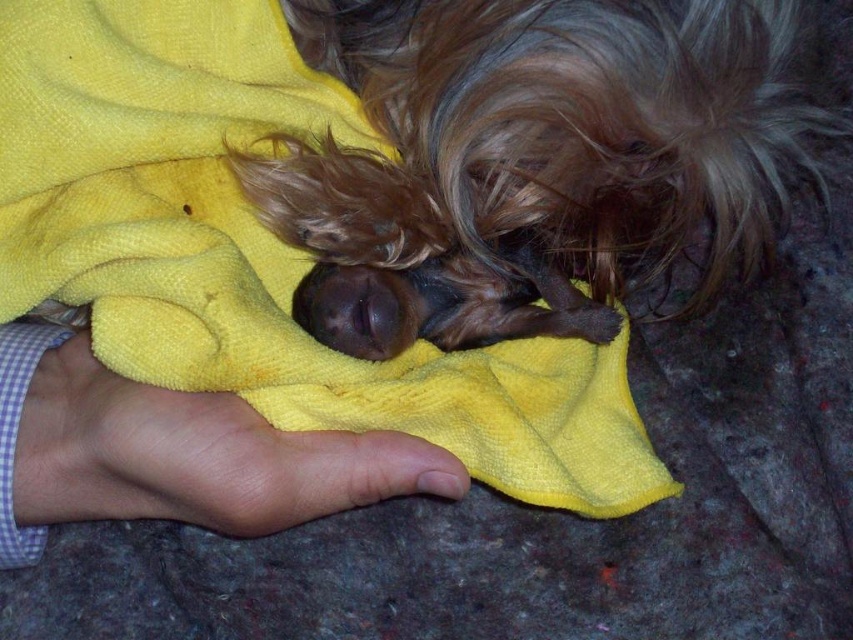
Question: Is shaggy brown fur at center to the right of yellow towel at center from the viewer's perspective?

Choices:
 (A) no
 (B) yes

Answer: (B)

Question: Among these points, which one is farthest from the camera?

Choices:
 (A) (753, 154)
 (B) (91, 371)
 (C) (171, 276)

Answer: (A)

Question: Is shaggy brown fur at center positioned at the back of yellow towel at center?

Choices:
 (A) no
 (B) yes

Answer: (B)

Question: Among these objects, which one is nearest to the camera?

Choices:
 (A) smooth skin hand at lower left
 (B) yellow towel at center
 (C) shaggy brown fur at center

Answer: (A)

Question: Which is nearer to the shaggy brown fur at center?

Choices:
 (A) smooth skin hand at lower left
 (B) yellow towel at center

Answer: (B)

Question: Does shaggy brown fur at center have a smaller size compared to yellow towel at center?

Choices:
 (A) yes
 (B) no

Answer: (A)